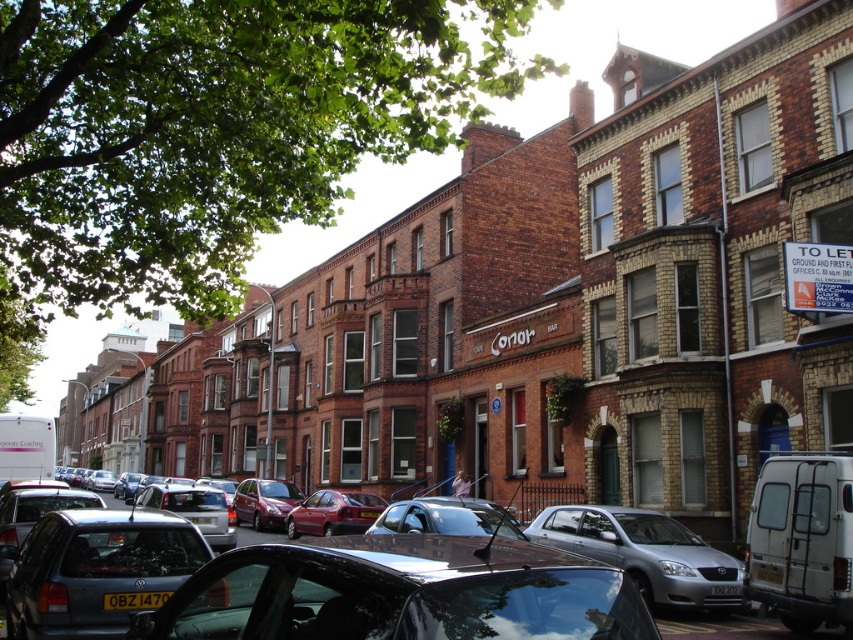
Question: Which object is farther from the camera taking this photo?

Choices:
 (A) black plastic license plate at lower center
 (B) yellow plastic license plate at center

Answer: (B)

Question: Which of these objects is positioned farthest from the black plastic license plate at lower center?

Choices:
 (A) silver metallic car at center
 (B) yellow plastic license plate at center

Answer: (A)

Question: Observing the image, what is the correct spatial positioning of silver metallic car at center in reference to black plastic license plate at lower center?

Choices:
 (A) left
 (B) right

Answer: (B)

Question: Is silver metallic car at center positioned before black plastic license plate at lower center?

Choices:
 (A) no
 (B) yes

Answer: (A)

Question: Which point is closer to the camera taking this photo?

Choices:
 (A) (123, 600)
 (B) (769, 580)

Answer: (A)

Question: Does silver metallic car at center have a lesser width compared to yellow plastic license plate at center?

Choices:
 (A) yes
 (B) no

Answer: (B)